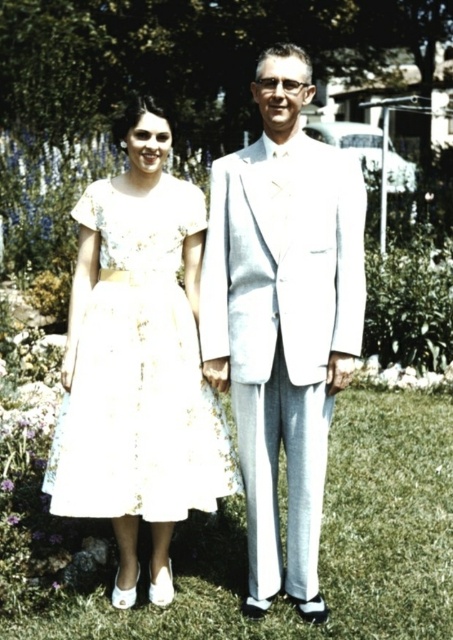
Does light gray suit at center appear over white lace dress at center?

Correct, light gray suit at center is located above white lace dress at center.

Is point (256, 342) farther from viewer compared to point (141, 259)?

No.

Identify the location of light gray suit at center. The height and width of the screenshot is (640, 453). (283, 317).